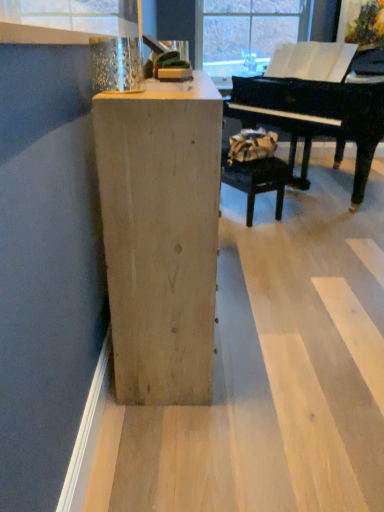
You are a GUI agent. You are given a task and a screenshot of the screen. Output one action in this format:
    pyautogui.click(x=<x>, y=<y>)
    Task: Click on the free point to the right of leather-like brown bag at center
    The image size is (384, 512).
    Given the screenshot: What is the action you would take?
    pyautogui.click(x=313, y=219)